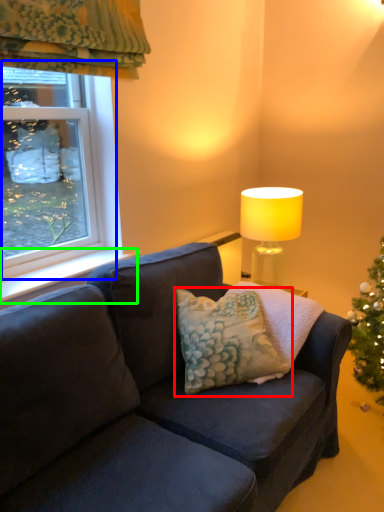
Question: Based on their relative distances, which object is nearer to pillow (highlighted by a red box)? Choose from window (highlighted by a blue box) and window sill (highlighted by a green box).

Choices:
 (A) window
 (B) window sill

Answer: (B)